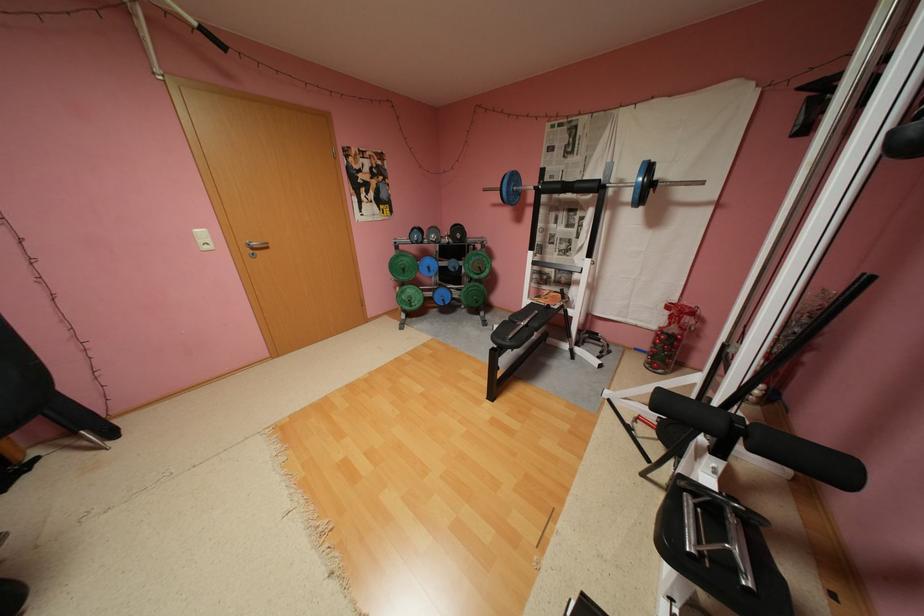
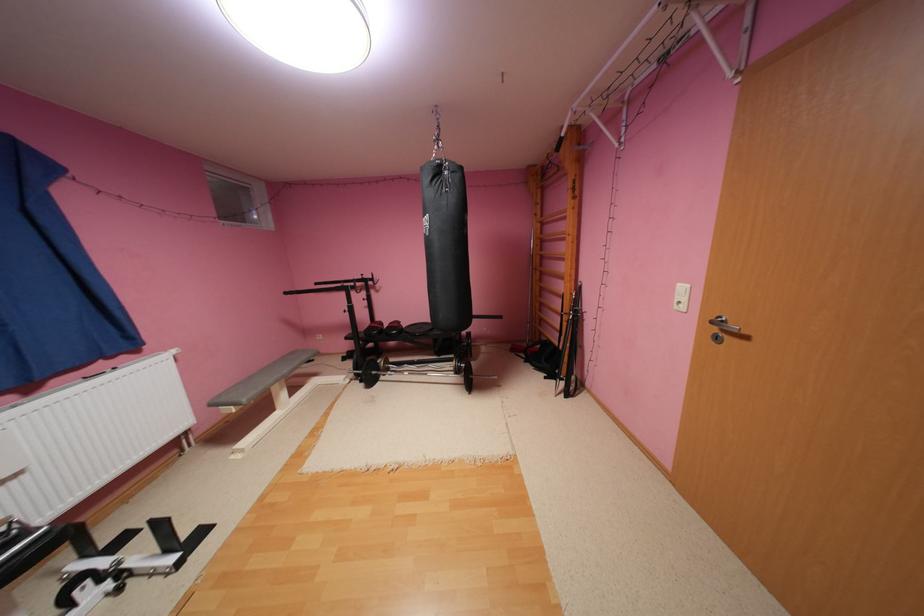
Locate, in the second image, the point that corresponds to [214,248] in the first image.

(686, 306)